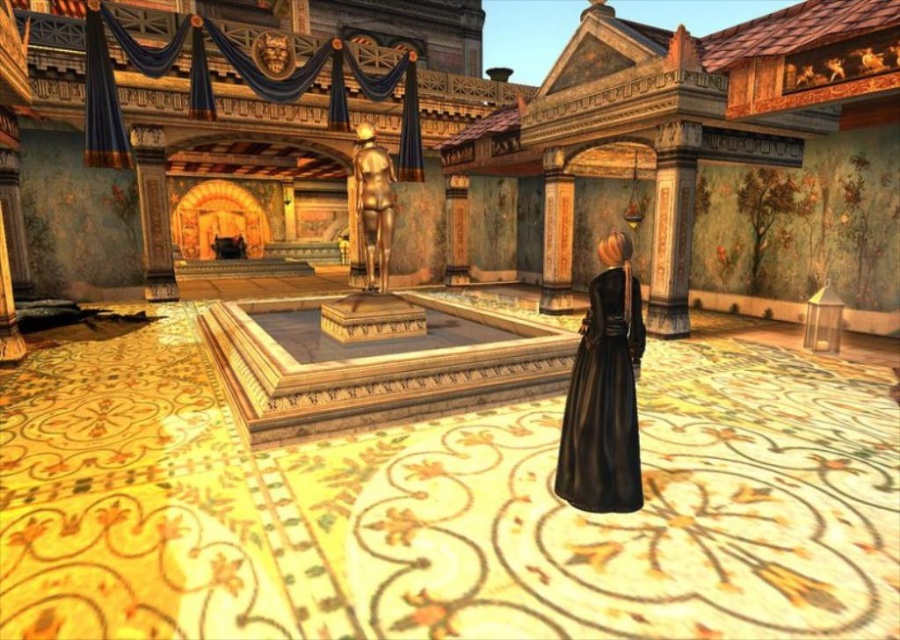
Is point (594, 285) closer to viewer compared to point (370, 141)?

That is True.

Which is more to the right, black leather dress at lower right or gold polished statue at center?

black leather dress at lower right

Is point (623, 336) closer to viewer compared to point (379, 157)?

Yes, it is.

Locate an element on the screen. black leather dress at lower right is located at coordinates (603, 401).